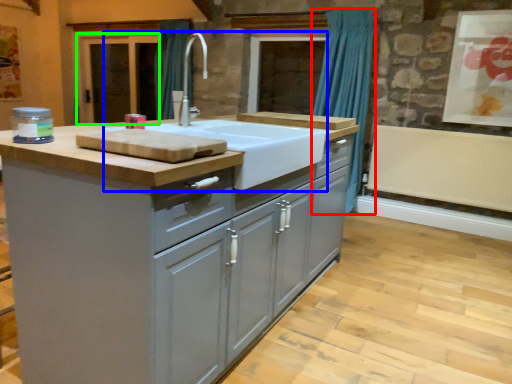
Question: Which is nearer to the curtain (highlighted by a red box)? sink (highlighted by a blue box) or screen door (highlighted by a green box).

Choices:
 (A) sink
 (B) screen door

Answer: (A)